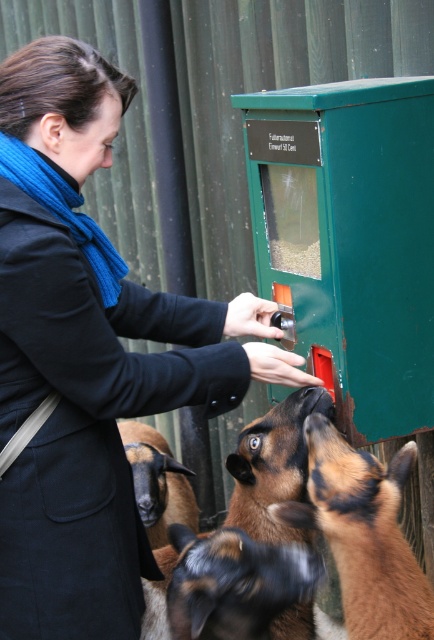
Question: Does blue wool scarf at upper left come in front of brown woolen goat at lower center?

Choices:
 (A) yes
 (B) no

Answer: (A)

Question: Which point appears closest to the camera in this image?

Choices:
 (A) (325, 448)
 (B) (7, 522)

Answer: (A)

Question: Is the position of blue wool scarf at upper left more distant than that of brown woolen goat at lower center?

Choices:
 (A) yes
 (B) no

Answer: (B)

Question: Which point is closer to the camera?

Choices:
 (A) (328, 404)
 (B) (144, 481)

Answer: (A)

Question: Is blue wool scarf at upper left wider than brown woolen goat at lower center?

Choices:
 (A) yes
 (B) no

Answer: (A)

Question: Considering the real-world distances, which object is farthest from the brown fuzzy goat at center?

Choices:
 (A) brown fuzzy sheep at lower center
 (B) brown woolen goat at lower center
 (C) brown furry goat at center
 (D) blue wool scarf at upper left

Answer: (B)